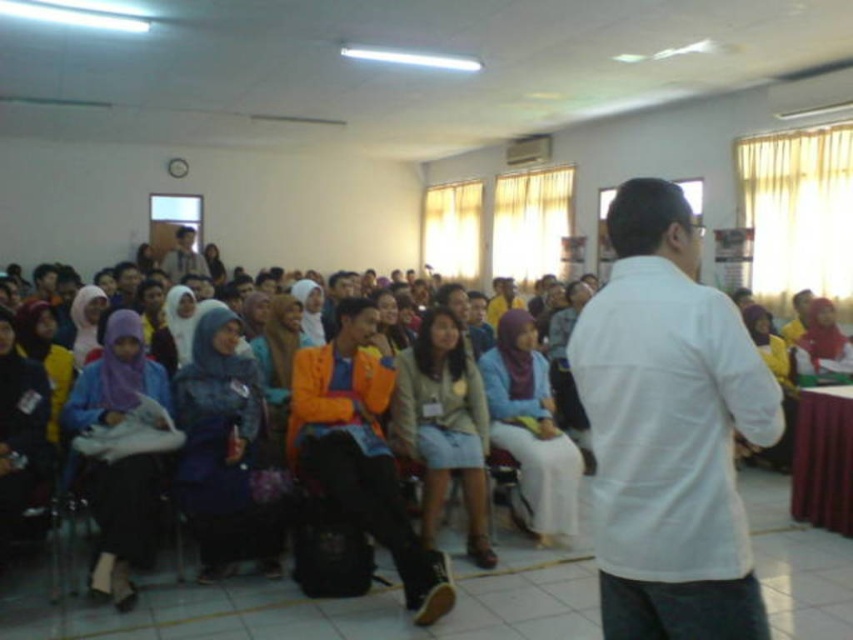
Question: Which point appears farthest from the camera in this image?

Choices:
 (A) (740, 323)
 (B) (177, 280)

Answer: (B)

Question: Which of the following is the farthest from the observer?

Choices:
 (A) white matte shirt at center
 (B) orange fabric shirt at center

Answer: (B)

Question: Is white matte shirt at center wider than orange fabric shirt at center?

Choices:
 (A) yes
 (B) no

Answer: (B)

Question: Which point appears closest to the camera in this image?

Choices:
 (A) (651, 248)
 (B) (184, 253)

Answer: (A)

Question: Is white matte shirt at center closer to the viewer compared to orange fabric shirt at center?

Choices:
 (A) no
 (B) yes

Answer: (B)

Question: Is white matte shirt at center closer to the viewer compared to orange fabric shirt at center?

Choices:
 (A) yes
 (B) no

Answer: (A)